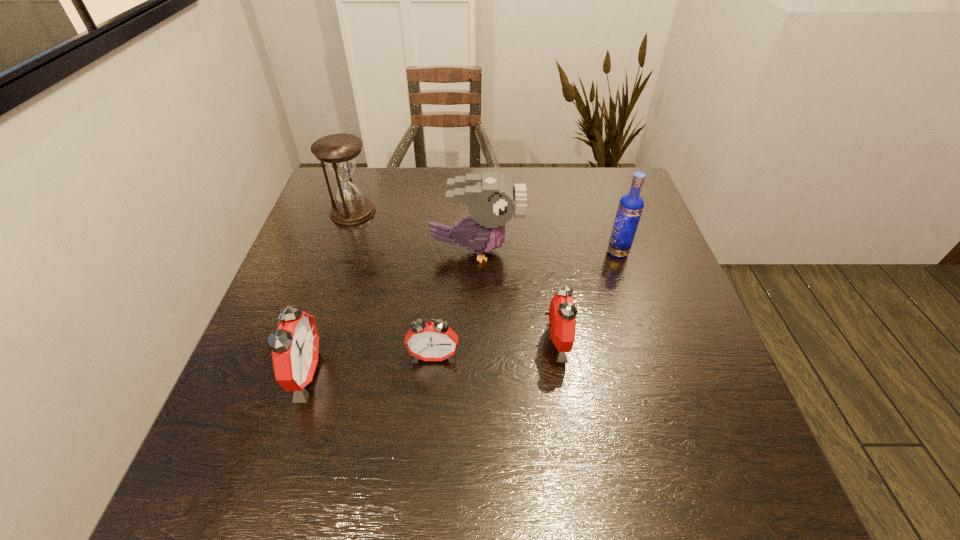
Image resolution: width=960 pixels, height=540 pixels. Identify the location of empty location between the bird and the rightmost object. (547, 252).

Where is `unoccupied area between the leftmost alarm clock and the shortest object`? The image size is (960, 540). unoccupied area between the leftmost alarm clock and the shortest object is located at coordinates (370, 365).

The width and height of the screenshot is (960, 540). What are the coordinates of `free space between the shortest alarm clock and the leftmost alarm clock` in the screenshot? It's located at (370, 365).

Identify the location of vacant space that's between the bird and the second tallest alarm clock. The height and width of the screenshot is (540, 960). (516, 296).

Where is `vacant space that's between the bird and the second object from right to left`? The image size is (960, 540). vacant space that's between the bird and the second object from right to left is located at coordinates (516, 296).

Where is `free point between the vodka and the second alarm clock from right to left`? This screenshot has width=960, height=540. free point between the vodka and the second alarm clock from right to left is located at coordinates (526, 305).

Where is `free point between the vodka and the fifth object from left to right`? The height and width of the screenshot is (540, 960). free point between the vodka and the fifth object from left to right is located at coordinates tap(587, 296).

Choose which object is the fourth nearest neighbor to the farthest object. Please provide its 2D coordinates. Your answer should be formatted as a tuple, i.e. [(x, y)], where the tuple contains the x and y coordinates of a point satisfying the conditions above.

[(562, 313)]

Locate an element on the screen. object identified as the fourth closest to the rightmost object is located at coordinates (339, 151).

Locate which alarm clock is the second closest to the rightmost alarm clock. Please provide its 2D coordinates. Your answer should be formatted as a tuple, i.e. [(x, y)], where the tuple contains the x and y coordinates of a point satisfying the conditions above.

[(295, 347)]